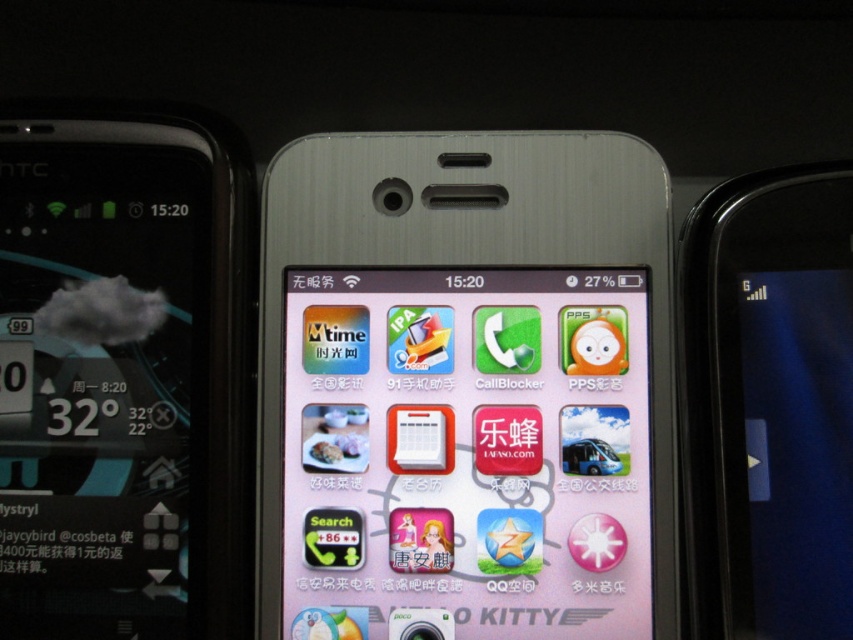
Is matte pink phone at center wider than black glossy smartphone at right?

Correct, the width of matte pink phone at center exceeds that of black glossy smartphone at right.

Is matte pink phone at center positioned behind black glossy smartphone at right?

Yes, matte pink phone at center is further from the viewer.

The image size is (853, 640). I want to click on matte pink phone at center, so click(466, 452).

This screenshot has width=853, height=640. Find the location of `matte pink phone at center`. matte pink phone at center is located at coordinates (466, 452).

Is point (354, 288) less distant than point (12, 568)?

No, it is not.

Which is below, matte pink phone at center or matte black smartphone at left?

matte pink phone at center

I want to click on matte pink phone at center, so click(466, 452).

Can you confirm if matte black smartphone at left is positioned above black glossy smartphone at right?

Indeed, matte black smartphone at left is positioned over black glossy smartphone at right.

Is point (192, 332) farther from camera compared to point (705, 246)?

Yes, it is behind point (705, 246).

At what (x,y) coordinates should I click in order to perform the action: click on matte black smartphone at left. Please return your answer as a coordinate pair (x, y). Looking at the image, I should click on (115, 378).